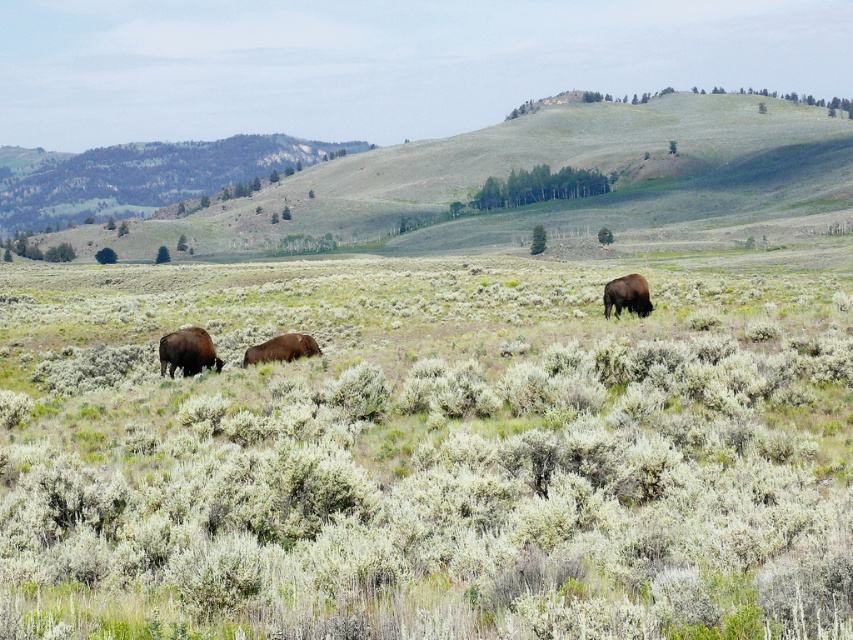
Does brown furry bison at left appear under brown fur bison at right?

Correct, brown furry bison at left is located below brown fur bison at right.

Does point (175, 332) lie in front of point (605, 300)?

That is True.

Who is more forward, (189,371) or (610,307)?

Point (189,371)

This screenshot has width=853, height=640. I want to click on brown furry bison at left, so click(187, 352).

Can you confirm if brown furry bison at left is shorter than brown furry bison at center?

In fact, brown furry bison at left may be taller than brown furry bison at center.

Is point (210, 342) in front of point (270, 353)?

No, it is not.

Find the location of a particular element. The image size is (853, 640). brown furry bison at left is located at coordinates (187, 352).

Can you confirm if green grassy hillside at center is thinner than brown furry bison at center?

No.

Is green grassy hillside at center wider than brown furry bison at center?

Correct, the width of green grassy hillside at center exceeds that of brown furry bison at center.

Is point (756, 108) in front of point (277, 353)?

No.

Identify the location of green grassy hillside at center. (556, 170).